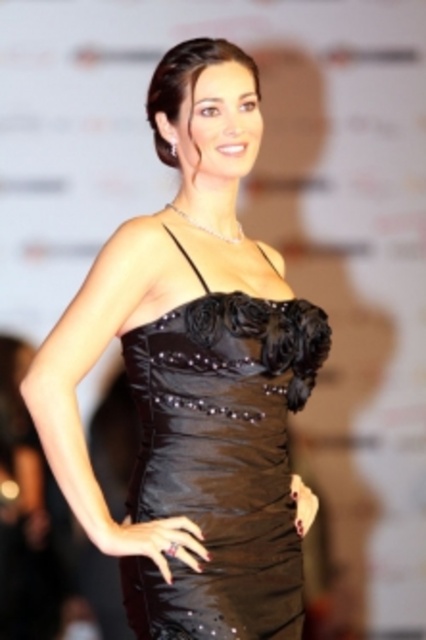
The woman in the image is wearing two dresses. The shiny satin dress at center and the shiny black dress at center. Which dress is wider?

The shiny satin dress at center is wider than the shiny black dress at center according to the description.

You are an event planner organizing a formal gala. You need to place a table exactly at the position where the shiny satin dress at center is located. What coordinates should you use for the table placement?

The shiny satin dress at center is located at coordinates point (195,378), so the table should be placed at those coordinates.